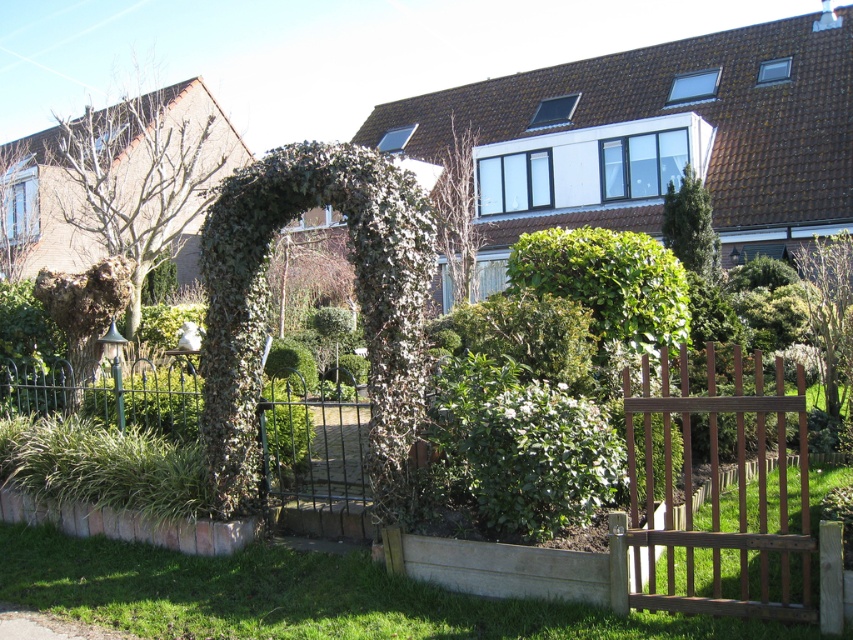
You are a gardener planning to install a sprinkler system between the green leafy tree at right and the green leafy tree at upper left. The sprinkler system requires a minimum of 20 meters of space between the trees to function properly. Based on the garden layout, will the sprinkler system fit between them?

The green leafy tree at right is 20.15 meters from the green leafy tree at upper left, which is just over the required 20 meters. Therefore, the sprinkler system will fit between them.

You are a gardener planning to plant a new tree that requires at least 4 meters of space between it and any existing plants. You see the green leafy bush at center and the bare wood tree at upper center. Can you plant the new tree between them without violating the spacing requirement?

The distance between the green leafy bush at center and the bare wood tree at upper center is 3.85 meters, which is less than the required 4 meters. Therefore, planting a new tree between them would violate the spacing requirement.